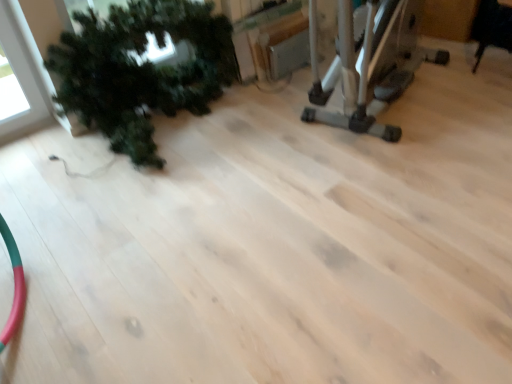
Question: Considering the relative positions of black leather chair at upper right and silver metallic elliptical trainer at upper right in the image provided, is black leather chair at upper right to the left of silver metallic elliptical trainer at upper right from the viewer's perspective?

Choices:
 (A) yes
 (B) no

Answer: (B)

Question: From a real-world perspective, is black leather chair at upper right on top of silver metallic elliptical trainer at upper right?

Choices:
 (A) no
 (B) yes

Answer: (A)

Question: Does black leather chair at upper right come in front of silver metallic elliptical trainer at upper right?

Choices:
 (A) no
 (B) yes

Answer: (A)

Question: Would you say black leather chair at upper right is a long distance from silver metallic elliptical trainer at upper right?

Choices:
 (A) yes
 (B) no

Answer: (B)

Question: Is silver metallic elliptical trainer at upper right at the back of black leather chair at upper right?

Choices:
 (A) yes
 (B) no

Answer: (B)

Question: Does black leather chair at upper right have a lesser width compared to silver metallic elliptical trainer at upper right?

Choices:
 (A) yes
 (B) no

Answer: (A)

Question: Is silver metallic elliptical trainer at upper right looking in the opposite direction of black leather chair at upper right?

Choices:
 (A) yes
 (B) no

Answer: (B)

Question: Is silver metallic elliptical trainer at upper right further to the viewer compared to black leather chair at upper right?

Choices:
 (A) yes
 (B) no

Answer: (B)

Question: From a real-world perspective, is silver metallic elliptical trainer at upper right positioned over black leather chair at upper right based on gravity?

Choices:
 (A) no
 (B) yes

Answer: (B)

Question: Is black leather chair at upper right located within silver metallic elliptical trainer at upper right?

Choices:
 (A) no
 (B) yes

Answer: (A)

Question: Can you confirm if silver metallic elliptical trainer at upper right is positioned to the right of black leather chair at upper right?

Choices:
 (A) no
 (B) yes

Answer: (A)

Question: Considering the relative sizes of silver metallic elliptical trainer at upper right and black leather chair at upper right in the image provided, is silver metallic elliptical trainer at upper right thinner than black leather chair at upper right?

Choices:
 (A) no
 (B) yes

Answer: (A)

Question: Considering the relative positions of black leather chair at upper right and green matte plant at left in the image provided, is black leather chair at upper right in front of green matte plant at left?

Choices:
 (A) yes
 (B) no

Answer: (B)